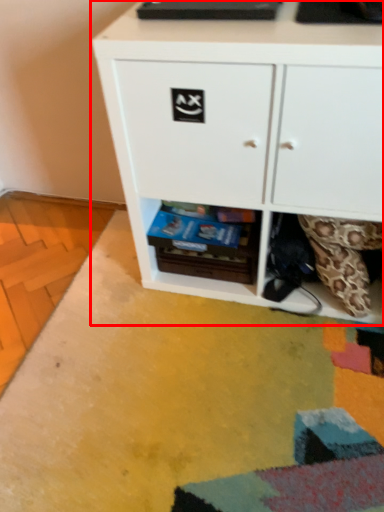
Question: From the image's perspective, what is the correct spatial positioning of chest of drawers (annotated by the red box) in reference to shelf?

Choices:
 (A) below
 (B) above

Answer: (B)